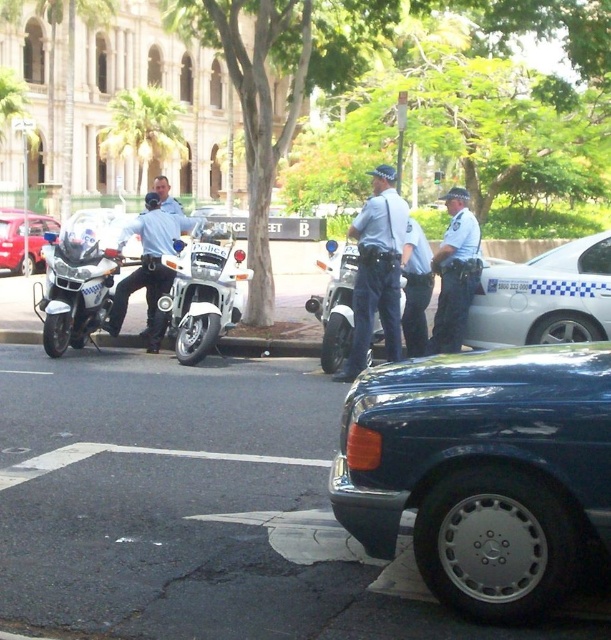
You are a photographer positioned at the center of the scene. You want to capture a photo that includes both the white glossy motorcycle at center and the dark sedan parked on the right. Which direction should you move to ensure both are in your frame?

Since the white glossy motorcycle at center is positioned at point [202,289], you should move slightly to the right to include both the white glossy motorcycle at center and the dark sedan parked on the right in your frame.

You are standing at the point marked as point (x=544, y=298) in the image. What object is located at this point?

The point (x=544, y=298) corresponds to the white checkered car at center right.